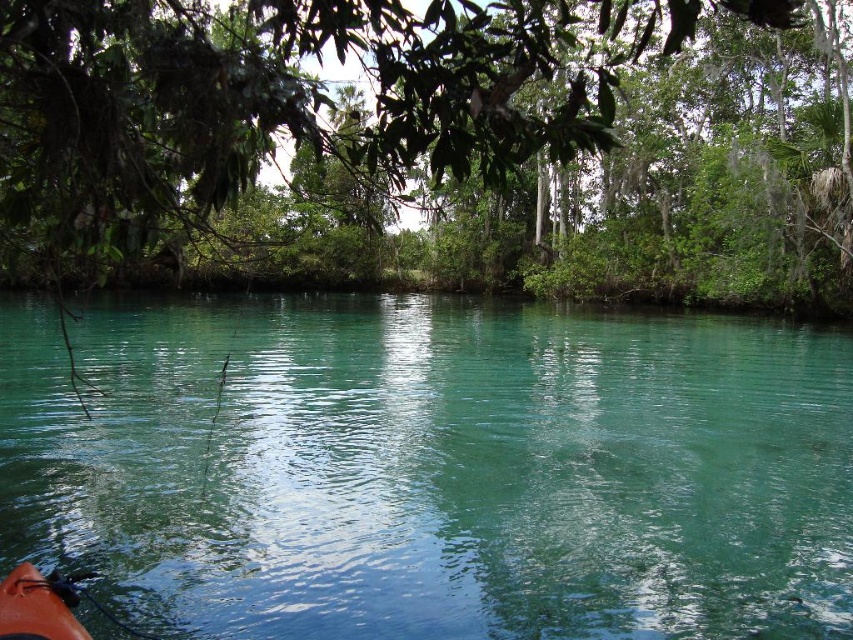
Question: Which point is farther from the camera taking this photo?

Choices:
 (A) (10, 113)
 (B) (297, 627)
 (C) (73, 602)

Answer: (B)

Question: Which object is closer to the camera taking this photo?

Choices:
 (A) teal glossy water at center
 (B) green leafy tree at upper center

Answer: (B)

Question: From the image, what is the correct spatial relationship of teal glossy water at center in relation to orange matte kayak at lower left?

Choices:
 (A) above
 (B) below

Answer: (A)

Question: Estimate the real-world distances between objects in this image. Which object is farther from the green leafy tree at upper center?

Choices:
 (A) teal glossy water at center
 (B) orange matte kayak at lower left

Answer: (B)

Question: Can you confirm if green leafy tree at upper center is positioned to the right of orange matte kayak at lower left?

Choices:
 (A) yes
 (B) no

Answer: (B)

Question: Observing the image, what is the correct spatial positioning of teal glossy water at center in reference to orange matte kayak at lower left?

Choices:
 (A) above
 (B) below

Answer: (A)